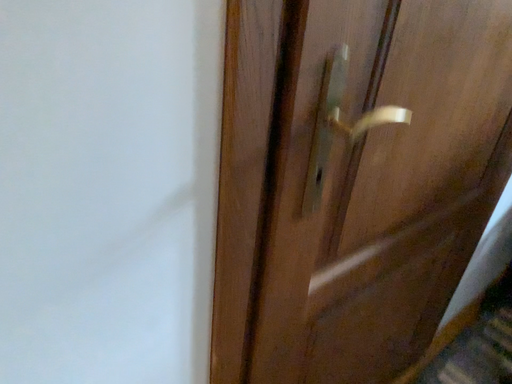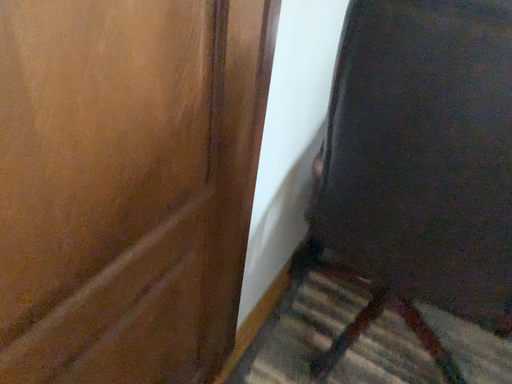
Question: Which way did the camera rotate in the video?

Choices:
 (A) rotated right
 (B) rotated left

Answer: (A)